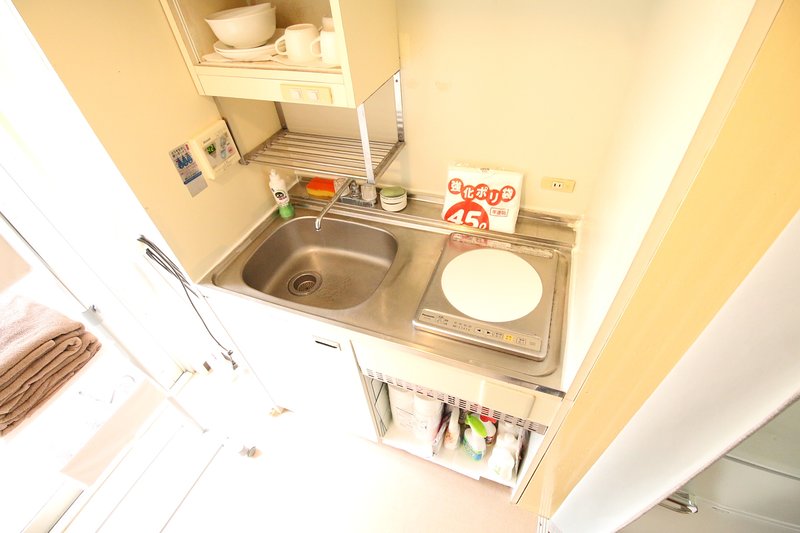
At what (x,y) coordinates should I click in order to perform the action: click on faucet. Please return your answer as a coordinate pair (x, y). Looking at the image, I should click on (337, 196).